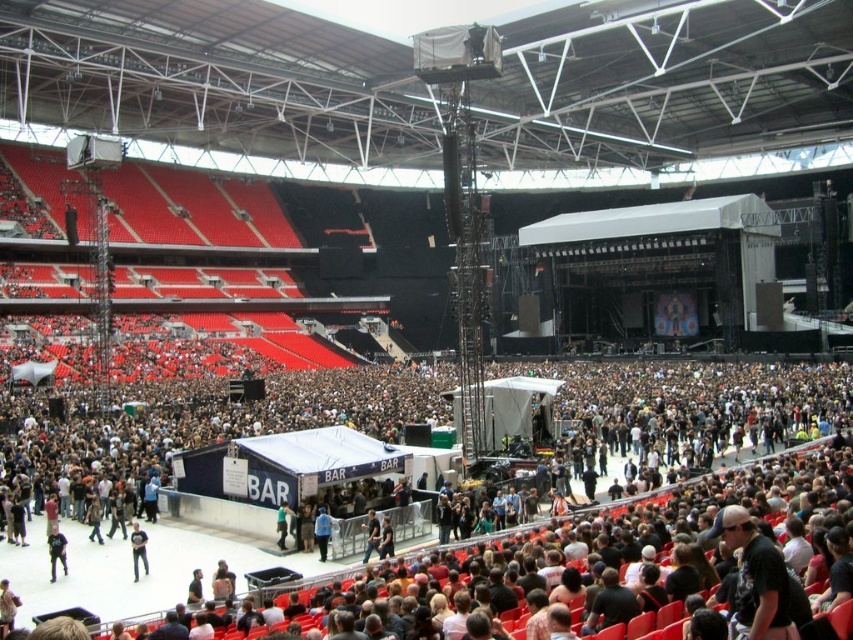
You are a photographer positioned at the back of the stadium. You want to take a photo of the black matte shirt at lower left and the blue fabric jacket at center so that both are fully visible. Considering their heights, which object should you focus on first to ensure both are in frame?

The black matte shirt at lower left is shorter than the blue fabric jacket at center. To ensure both are fully visible, focus on the blue fabric jacket at center first, as it is taller, and adjust the camera angle to include the shorter black matte shirt at lower left.